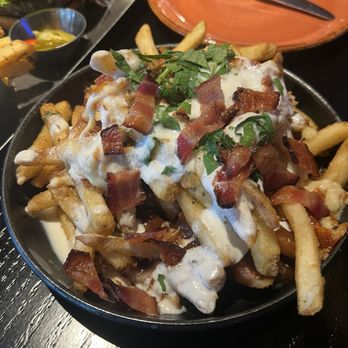
Locate an element on the screen. This screenshot has height=348, width=348. shadow on table is located at coordinates (247, 329).